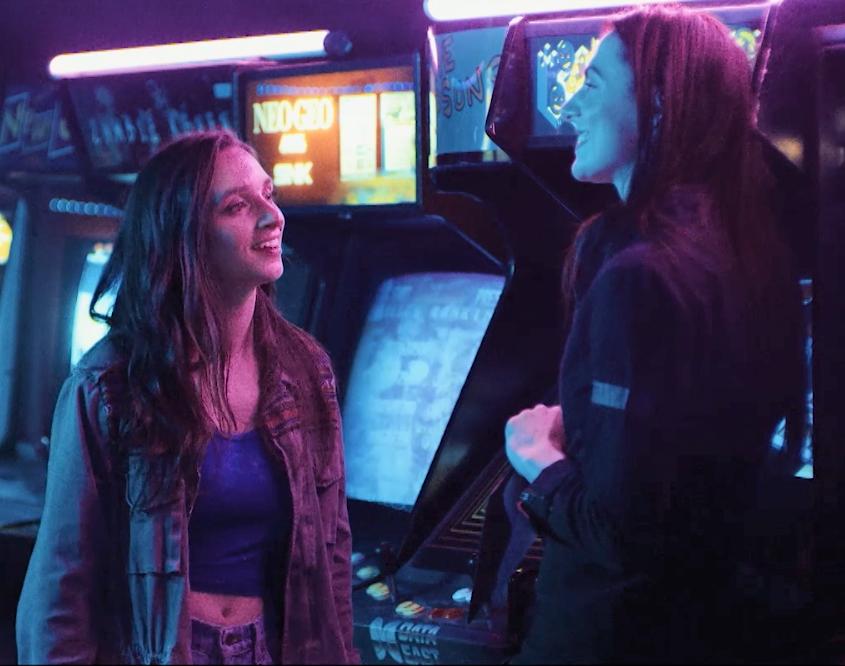
Find the location of a particular element. arcade game is located at coordinates (431, 333), (535, 117).